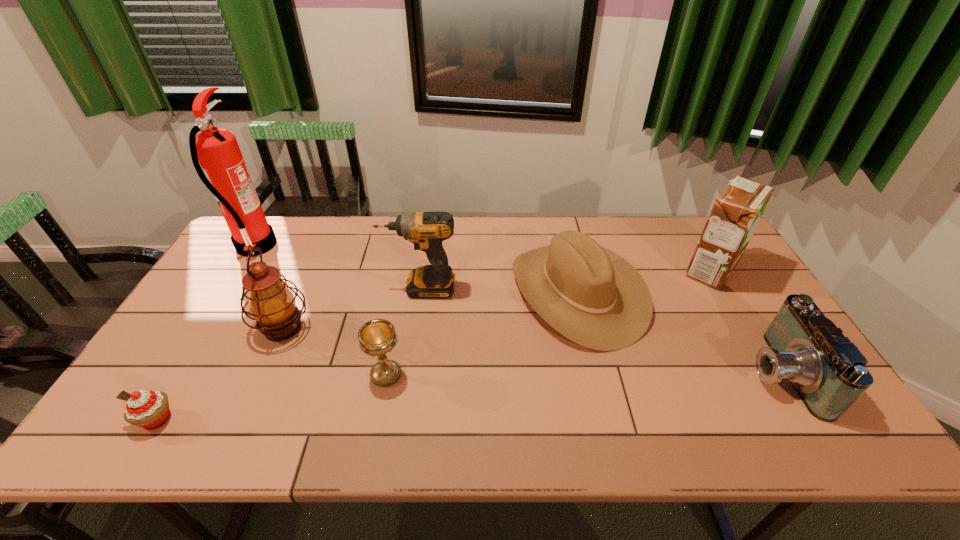
Locate an element on the screen. The image size is (960, 540). vacant region at the far right corner of the desktop is located at coordinates (702, 218).

Find the location of a particular element. The height and width of the screenshot is (540, 960). vacant space at the near right corner is located at coordinates (805, 437).

The image size is (960, 540). Find the location of `vacant point located between the shortest object and the oil lamp`. vacant point located between the shortest object and the oil lamp is located at coordinates (220, 374).

This screenshot has height=540, width=960. Find the location of `vacant space in between the drill and the third object from right to left`. vacant space in between the drill and the third object from right to left is located at coordinates (499, 291).

At what (x,y) coordinates should I click in order to perform the action: click on empty location between the shortest object and the chalice. Please return your answer as a coordinate pair (x, y). Looking at the image, I should click on (272, 396).

Locate an element on the screen. unoccupied position between the chalice and the camcorder is located at coordinates click(x=583, y=373).

Locate an element on the screen. This screenshot has height=540, width=960. empty space between the chalice and the drill is located at coordinates (403, 331).

Identify the location of free space between the cupcake and the fire extinguisher. (206, 333).

Where is `free area in between the third object from left to right and the sixth object from left to right`? This screenshot has width=960, height=540. free area in between the third object from left to right and the sixth object from left to right is located at coordinates (430, 310).

Locate an element on the screen. This screenshot has height=540, width=960. free point between the drill and the cupcake is located at coordinates (289, 354).